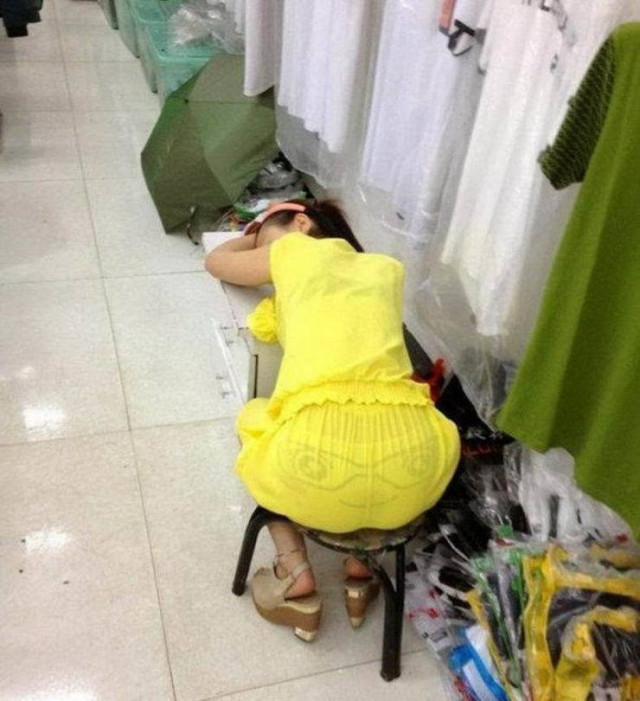
I want to click on drawer handle, so click(x=230, y=341), click(x=219, y=392).